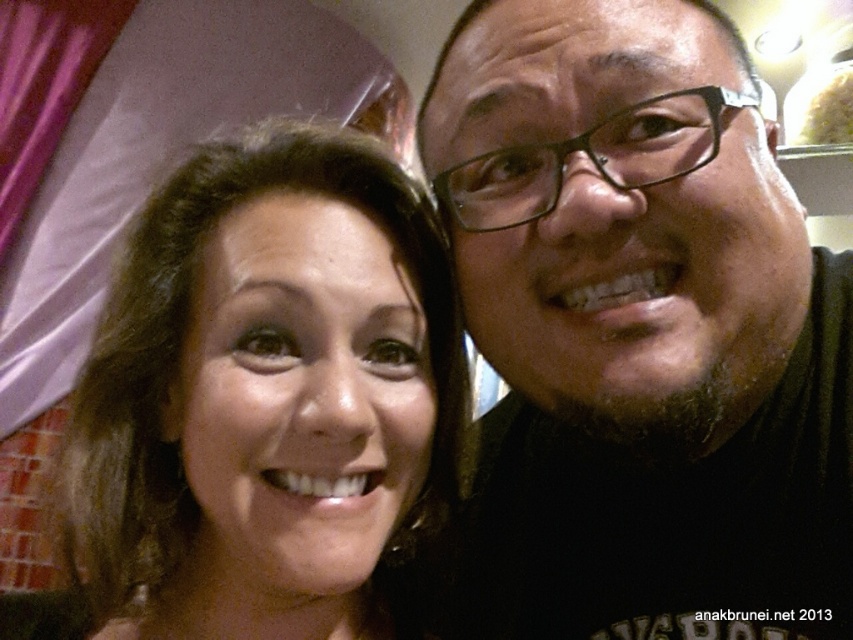
You are a photographer trying to focus on the matte brown hair at center. However, the black matte glasses at upper right is blocking your view. Can you tell me if the glasses are above or below the hair?

The black matte glasses at upper right is positioned over matte brown hair at center, so the glasses are above the hair.

Looking at the scene where a man and a woman are taking a selfie, can you determine which object is taller between the black matte glasses at upper right and the matte brown hair at center?

The black matte glasses at upper right has a greater height compared to the matte brown hair at center, so the black matte glasses at upper right is taller.